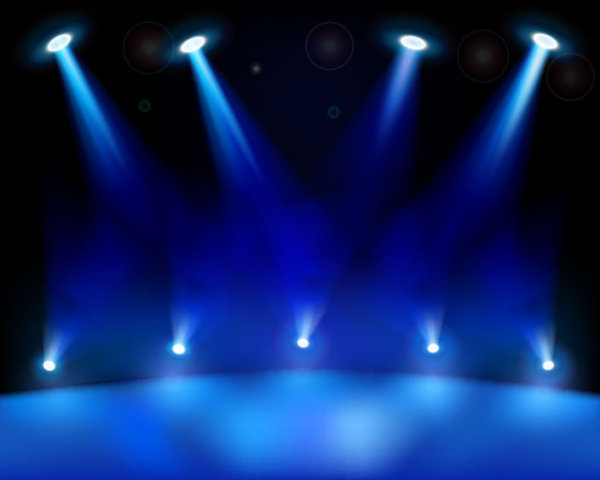
Identify the location of spotlights. This screenshot has width=600, height=480. (80, 108), (222, 110), (395, 103), (502, 121), (539, 341), (430, 329), (311, 323), (184, 323), (59, 338).